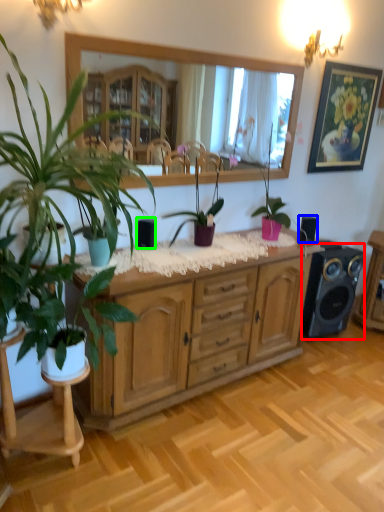
Question: Based on their relative distances, which object is nearer to speaker (highlighted by a red box)? Choose from speaker (highlighted by a blue box) and speaker (highlighted by a green box).

Choices:
 (A) speaker
 (B) speaker

Answer: (A)